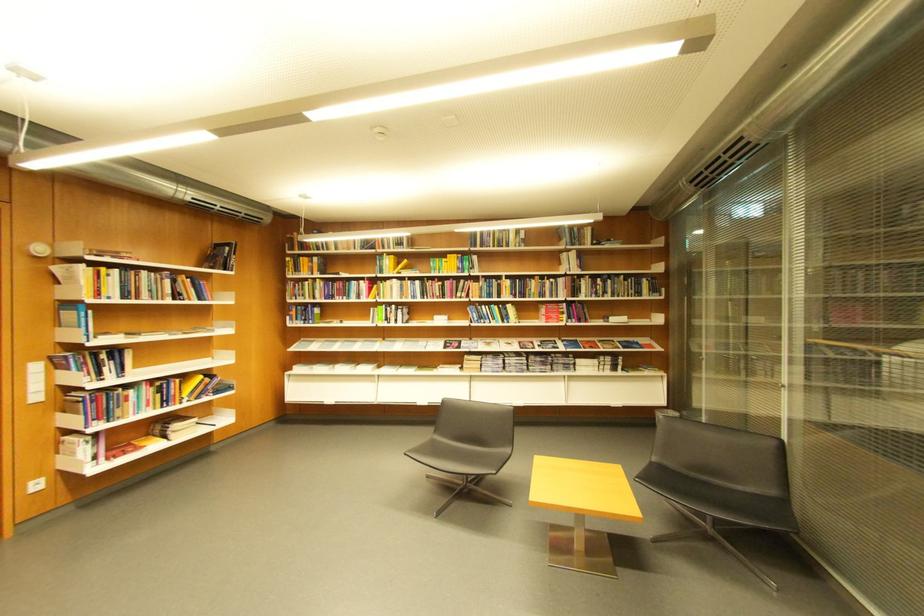
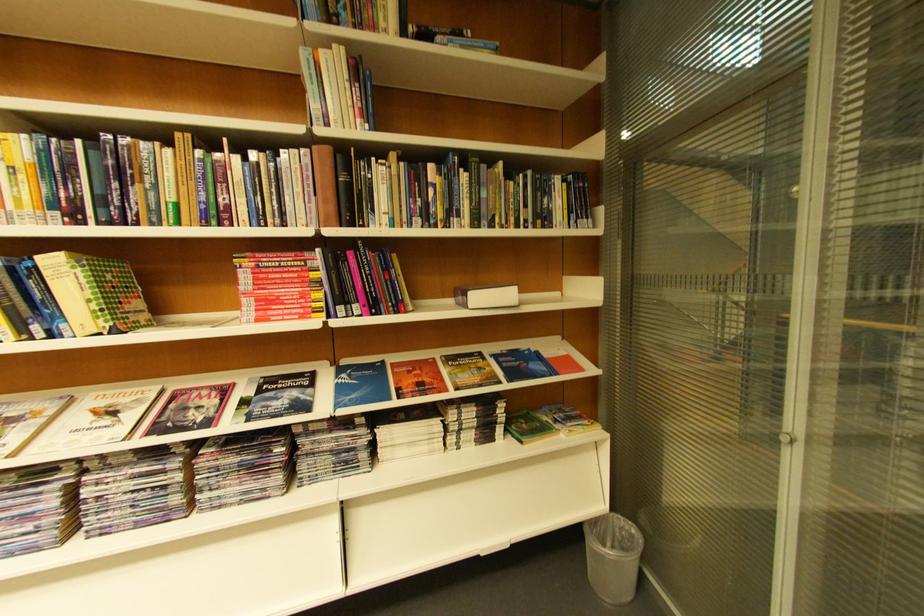
Question: I am providing you with two images of the same scene from different viewpoints. Which of the following objects are not visible in image2?

Choices:
 (A) red spine book
 (B) Forschung magazine
 (C) stacked magazine
 (D) none of these

Answer: (D)